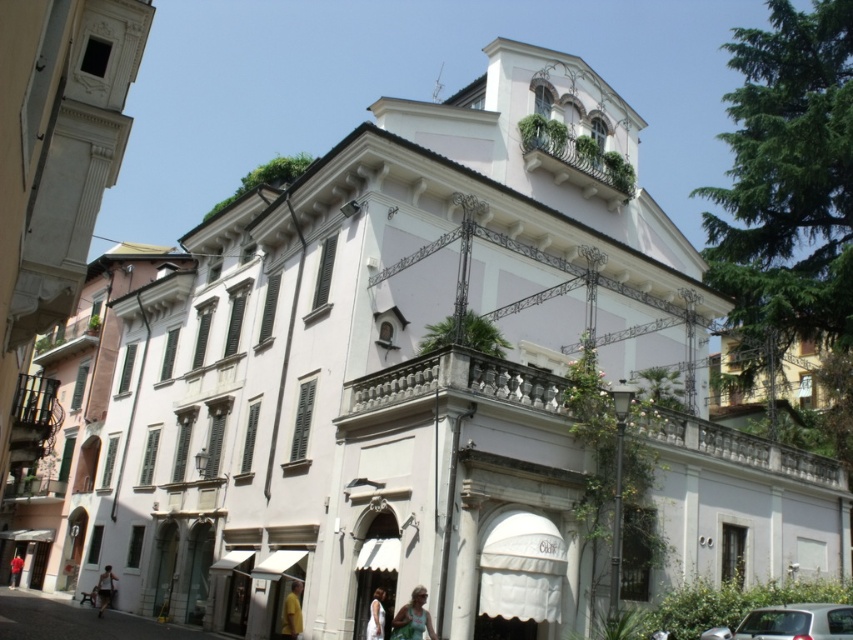
You are a delivery person standing at the entrance of the building. You need to hand over a package to a person with light brown hair at lower center who is wearing a light brown leather jacket at lower left. Can you determine if you can easily hand over the package without moving closer than 10 feet?

The light brown hair at lower center and light brown leather jacket at lower left are 133.37 feet apart from each other. Since the distance between them is much greater than 10 feet, you cannot easily hand over the package without moving closer.